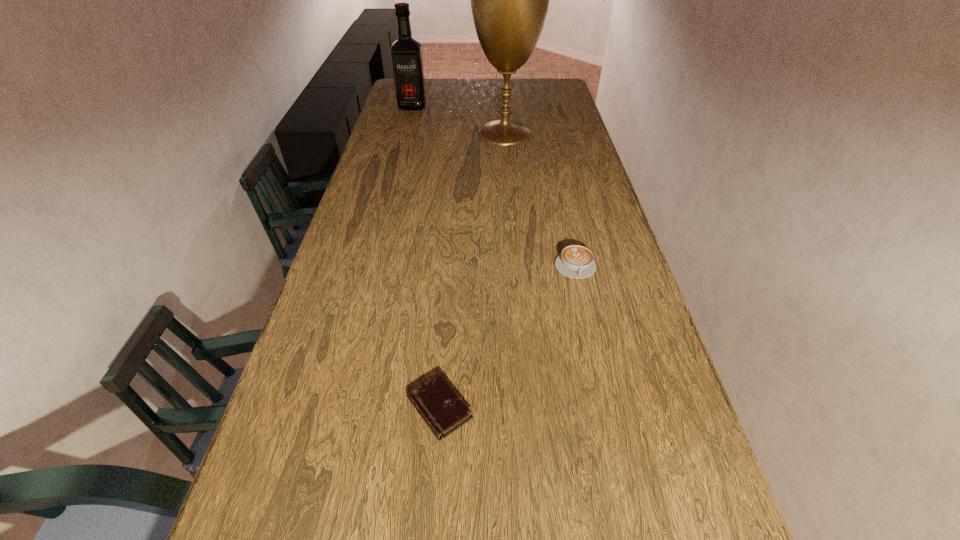
The height and width of the screenshot is (540, 960). Identify the location of the tallest object. (509, 0).

Where is `the third nearest object`? The image size is (960, 540). the third nearest object is located at coordinates (509, 0).

Locate an element on the screen. the farthest object is located at coordinates (406, 53).

Where is `the third shortest object`? The width and height of the screenshot is (960, 540). the third shortest object is located at coordinates (406, 53).

This screenshot has height=540, width=960. Identify the location of cappuccino. (575, 261).

Where is `the third farthest object`? This screenshot has height=540, width=960. the third farthest object is located at coordinates (575, 261).

Where is `the shortest object`? The image size is (960, 540). the shortest object is located at coordinates (439, 405).

Find the location of a particular element. The width and height of the screenshot is (960, 540). diary is located at coordinates (439, 405).

Locate an element on the screen. The image size is (960, 540). vacant position located on the back of the trophy cup is located at coordinates (503, 113).

You are a GUI agent. You are given a task and a screenshot of the screen. Output one action in this format:
    pyautogui.click(x=<x>, y=<y>)
    Task: Click on the vacant space situated 0.200m on the front-facing side of the farthest object
    The width and height of the screenshot is (960, 540).
    Given the screenshot: What is the action you would take?
    (x=405, y=132)